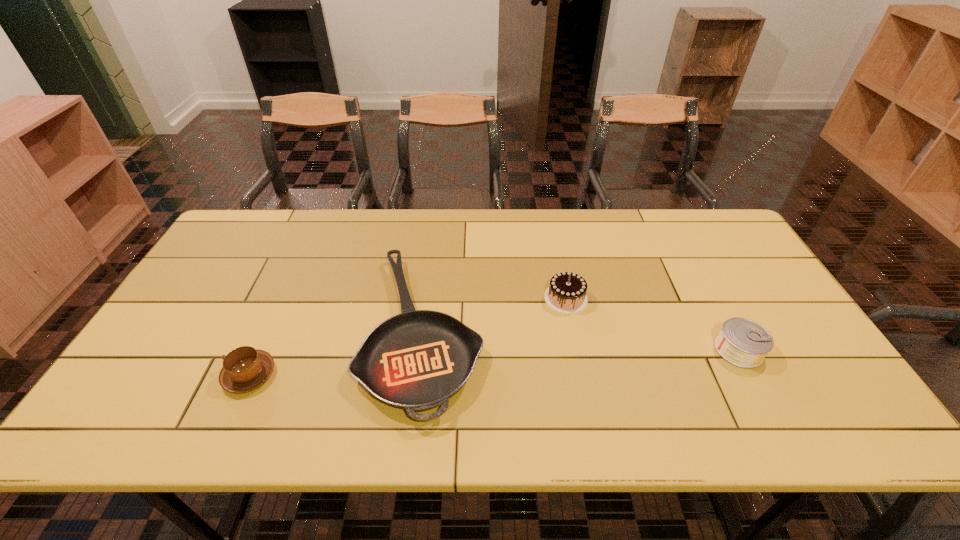
I want to click on empty space that is in between the chocolate cake and the shortest object, so click(494, 314).

Locate an element on the screen. This screenshot has width=960, height=540. free spot between the frying pan and the leftmost object is located at coordinates (337, 353).

Locate an element on the screen. vacant area that lies between the tallest object and the can is located at coordinates (652, 324).

At what (x,y) coordinates should I click in order to perform the action: click on free spot between the rightmost object and the frying pan. Please return your answer as a coordinate pair (x, y). The height and width of the screenshot is (540, 960). Looking at the image, I should click on (x=581, y=340).

The height and width of the screenshot is (540, 960). What are the coordinates of `vacant space in between the can and the third object from right to left` in the screenshot? It's located at click(581, 340).

You are a GUI agent. You are given a task and a screenshot of the screen. Output one action in this format:
    pyautogui.click(x=<x>, y=<y>)
    Task: Click on the free area in between the leftmost object and the can
    The height and width of the screenshot is (540, 960).
    Given the screenshot: What is the action you would take?
    pyautogui.click(x=494, y=362)

In order to click on free point between the third object from left to right and the rightmost object in this screenshot , I will do `click(652, 324)`.

The image size is (960, 540). Identify the location of vacant space that's between the rightmost object and the cappuccino. (494, 362).

Locate which object ranks in proximity to the shortest object. Please provide its 2D coordinates. Your answer should be formatted as a tuple, i.e. [(x, y)], where the tuple contains the x and y coordinates of a point satisfying the conditions above.

[(566, 294)]

This screenshot has width=960, height=540. Find the location of `object that is the second closest one to the can`. object that is the second closest one to the can is located at coordinates (417, 360).